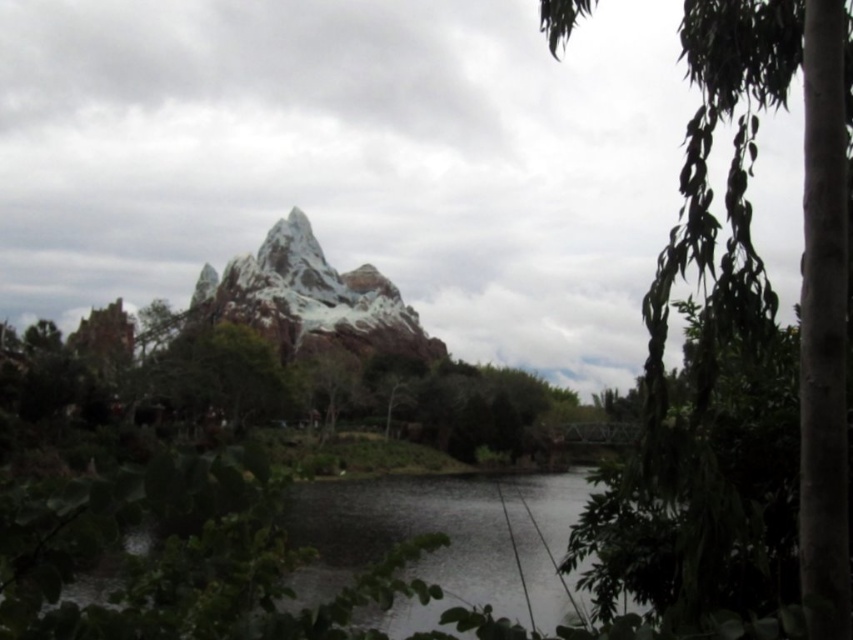
Is green leafy tree at right closer to the viewer compared to snowy rock mountain at center?

Yes, green leafy tree at right is closer to the viewer.

Who is more distant from viewer, [822,36] or [300,278]?

The point [300,278] is behind.

Does point (724, 35) lie in front of point (247, 284)?

Yes, it is.

The height and width of the screenshot is (640, 853). I want to click on green leafy tree at right, so click(x=804, y=248).

Is green leafy tree at right in front of dark reflective water at center?

Yes.

Is green leafy tree at right smaller than dark reflective water at center?

No.

Does point (827, 218) come in front of point (546, 477)?

Yes, it is.

Locate an element on the screen. Image resolution: width=853 pixels, height=640 pixels. green leafy tree at right is located at coordinates (804, 248).

Is dark reflective water at center in front of snowy rock mountain at center?

Yes.

Is point (434, 502) less distant than point (283, 336)?

Yes, it is.

In order to click on dark reflective water at center in this screenshot , I will do `click(450, 540)`.